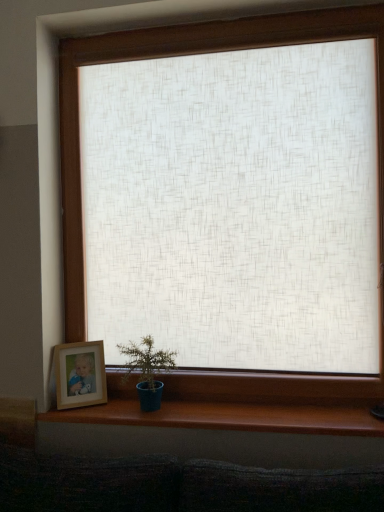
Question: From a real-world perspective, is blue matte pot at lower left on brown wood at lower center?

Choices:
 (A) yes
 (B) no

Answer: (A)

Question: Is blue matte pot at lower left taller than brown wood at lower center?

Choices:
 (A) no
 (B) yes

Answer: (B)

Question: Considering the relative sizes of blue matte pot at lower left and brown wood at lower center in the image provided, is blue matte pot at lower left smaller than brown wood at lower center?

Choices:
 (A) no
 (B) yes

Answer: (A)

Question: Can you confirm if blue matte pot at lower left is thinner than brown wood at lower center?

Choices:
 (A) yes
 (B) no

Answer: (B)

Question: Is blue matte pot at lower left in contact with brown wood at lower center?

Choices:
 (A) no
 (B) yes

Answer: (A)

Question: In terms of height, does brown wood at lower center look taller or shorter compared to blue matte pot at lower left?

Choices:
 (A) short
 (B) tall

Answer: (A)

Question: From a real-world perspective, is brown wood at lower center above or below blue matte pot at lower left?

Choices:
 (A) below
 (B) above

Answer: (A)

Question: Considering the positions of point (281, 411) and point (134, 354), is point (281, 411) closer or farther from the camera than point (134, 354)?

Choices:
 (A) closer
 (B) farther

Answer: (A)

Question: Is brown wood at lower center wider or thinner than blue matte pot at lower left?

Choices:
 (A) wide
 (B) thin

Answer: (B)

Question: Is blue matte pot at lower left in front of or behind wooden picture frame at lower left in the image?

Choices:
 (A) front
 (B) behind

Answer: (A)

Question: In terms of size, does blue matte pot at lower left appear bigger or smaller than wooden picture frame at lower left?

Choices:
 (A) big
 (B) small

Answer: (A)

Question: Considering the relative positions of blue matte pot at lower left and wooden picture frame at lower left in the image provided, is blue matte pot at lower left to the left or to the right of wooden picture frame at lower left?

Choices:
 (A) right
 (B) left

Answer: (A)

Question: Is point click(x=158, y=404) closer or farther from the camera than point click(x=72, y=382)?

Choices:
 (A) closer
 (B) farther

Answer: (A)

Question: Considering the positions of brown wood at lower center and wooden picture frame at lower left in the image, is brown wood at lower center wider or thinner than wooden picture frame at lower left?

Choices:
 (A) wide
 (B) thin

Answer: (A)

Question: Is brown wood at lower center inside the boundaries of wooden picture frame at lower left, or outside?

Choices:
 (A) outside
 (B) inside

Answer: (A)